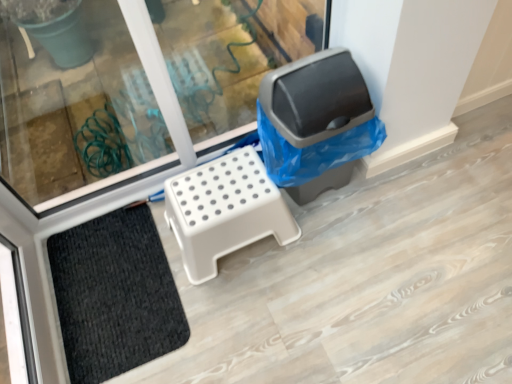
This screenshot has width=512, height=384. I want to click on vacant space to the right of black textured mat at lower left, so click(x=244, y=297).